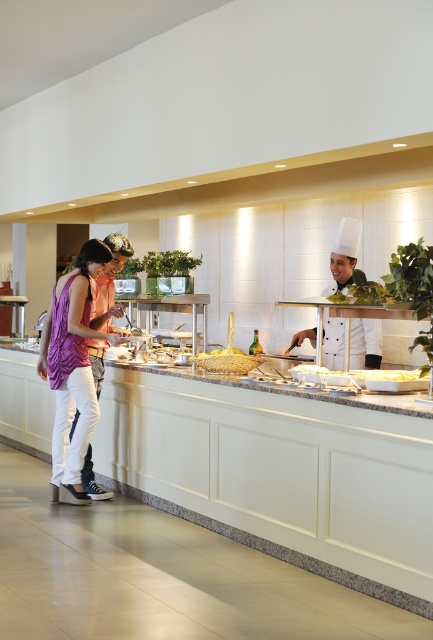
Question: Which point appears farthest from the camera in this image?

Choices:
 (A) (323, 465)
 (B) (329, 264)
 (C) (80, 490)

Answer: (B)

Question: Can you confirm if purple fabric dress at left is positioned above yellow matte pasta at center?

Choices:
 (A) yes
 (B) no

Answer: (A)

Question: Which point is closer to the camera taking this photo?

Choices:
 (A) (258, 356)
 (B) (371, 378)
 (C) (348, 282)

Answer: (B)

Question: Which object is positioned closest to the white chef hat at center?

Choices:
 (A) purple fabric dress at left
 (B) yellow matte pasta at center
 (C) golden textured bread at center
 (D) white marble counter at center

Answer: (C)

Question: Can you confirm if white marble counter at center is thinner than purple fabric dress at left?

Choices:
 (A) yes
 (B) no

Answer: (B)

Question: Is white marble counter at center to the left of yellow matte pasta at center from the viewer's perspective?

Choices:
 (A) yes
 (B) no

Answer: (A)